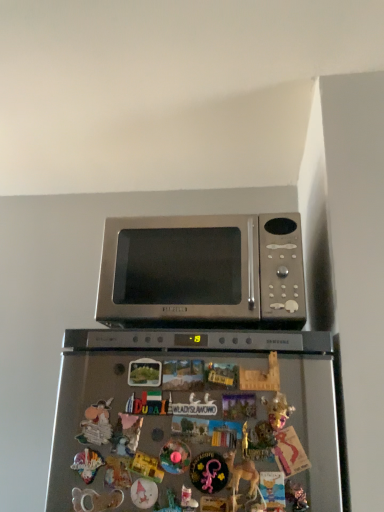
Question: From the image's perspective, relative to satin silver microwave at upper center, is gold metallic mask at upper center above or below?

Choices:
 (A) below
 (B) above

Answer: (A)

Question: Considering the positions of gold metallic mask at upper center and satin silver microwave at upper center in the image, is gold metallic mask at upper center bigger or smaller than satin silver microwave at upper center?

Choices:
 (A) small
 (B) big

Answer: (A)

Question: Does point (279, 400) appear closer or farther from the camera than point (132, 318)?

Choices:
 (A) farther
 (B) closer

Answer: (B)

Question: Based on their positions, is satin silver microwave at upper center located to the left or right of gold metallic mask at upper center?

Choices:
 (A) left
 (B) right

Answer: (A)

Question: From a real-world perspective, is satin silver microwave at upper center above or below gold metallic mask at upper center?

Choices:
 (A) above
 (B) below

Answer: (A)

Question: Is satin silver microwave at upper center inside or outside of gold metallic mask at upper center?

Choices:
 (A) inside
 (B) outside

Answer: (B)

Question: Is point (140, 217) positioned closer to the camera than point (289, 409)?

Choices:
 (A) closer
 (B) farther

Answer: (B)